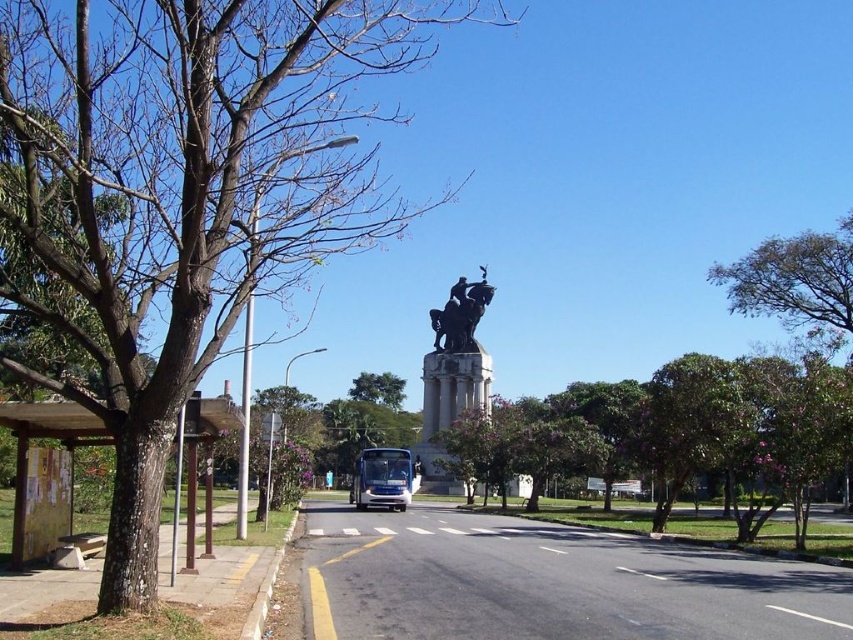
Question: Which point is farther to the camera?

Choices:
 (A) polished bronze statue at center
 (B) green leafy tree at center
 (C) white glossy bus at center

Answer: (B)

Question: Does green leafy tree at center have a greater width compared to shiny blue bus at center?

Choices:
 (A) yes
 (B) no

Answer: (A)

Question: Is white glossy bus at center to the right of green leafy tree at center from the viewer's perspective?

Choices:
 (A) yes
 (B) no

Answer: (A)

Question: Where is green leafy tree at upper right located in relation to white glossy bus at center in the image?

Choices:
 (A) left
 (B) right

Answer: (B)

Question: Which point is farther to the camera?

Choices:
 (A) polished bronze statue at center
 (B) green leafy tree at center
 (C) white glossy bus at center

Answer: (B)

Question: Which is nearer to the brown bark tree at center?

Choices:
 (A) shiny blue bus at center
 (B) polished bronze statue at center

Answer: (B)